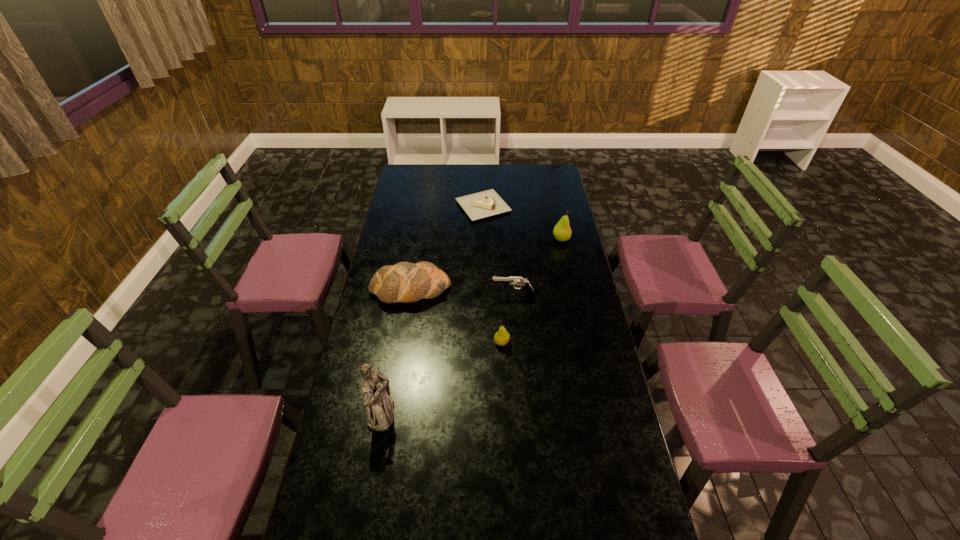
Find the location of a particular element. vacant space located 0.210m on the left of the shorter pear is located at coordinates (437, 342).

Identify the location of vacant space located 0.180m on the front of the fifth shortest object. This screenshot has height=540, width=960. (568, 271).

Image resolution: width=960 pixels, height=540 pixels. Find the location of `free space located on the left of the shortest object`. free space located on the left of the shortest object is located at coordinates (430, 207).

The height and width of the screenshot is (540, 960). Identify the location of vacant space located on the right of the bread. (466, 290).

Where is `vacant space located 0.370m at the muzzle of the gun`? vacant space located 0.370m at the muzzle of the gun is located at coordinates (401, 295).

This screenshot has width=960, height=540. Find the location of `vacant space situated 0.400m at the muzzle of the gun`. vacant space situated 0.400m at the muzzle of the gun is located at coordinates (395, 295).

You are a GUI agent. You are given a task and a screenshot of the screen. Output one action in this format:
    pyautogui.click(x=<x>, y=<y>)
    Task: Click on the vacant space located 0.090m at the muzzle of the gun
    The image size is (960, 540).
    Given the screenshot: What is the action you would take?
    pyautogui.click(x=470, y=295)

Where is `free space located on the front-facing side of the tallest object`? free space located on the front-facing side of the tallest object is located at coordinates [516, 413].

At what (x,y) coordinates should I click in order to perform the action: click on bread positioned at the left edge. Please return your answer as a coordinate pair (x, y). Looking at the image, I should click on (406, 282).

Find the location of `figurine that is at the left edge`. figurine that is at the left edge is located at coordinates point(379,405).